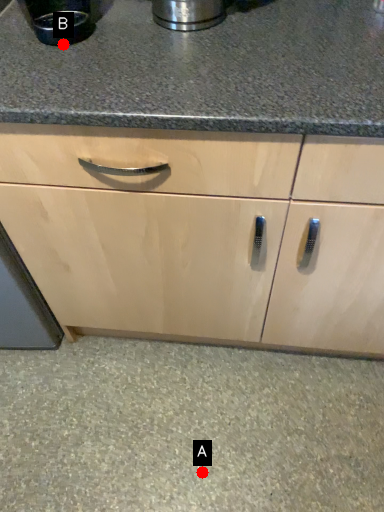
Question: Two points are circled on the image, labeled by A and B beside each circle. Which point appears farthest from the camera in this image?

Choices:
 (A) A is further
 (B) B is further

Answer: (A)